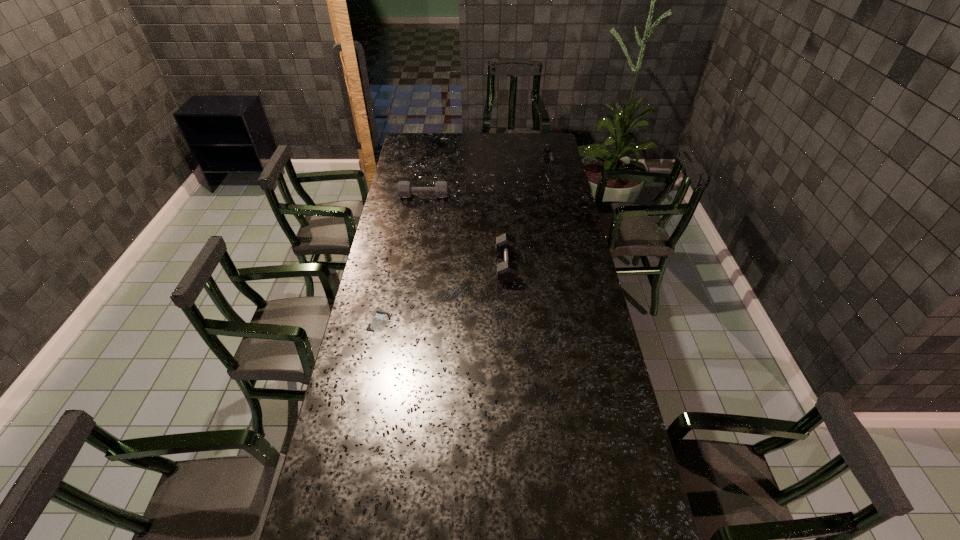
You are a GUI agent. You are given a task and a screenshot of the screen. Output one action in this format:
    pyautogui.click(x=<x>, y=<y>)
    Task: Click on the free space located 0.190m on the back of the second farthest dumbbell
    This screenshot has height=540, width=960.
    Given the screenshot: What is the action you would take?
    [428, 171]

Image resolution: width=960 pixels, height=540 pixels. I want to click on free space located 0.160m on the back of the shortest object, so click(x=388, y=280).

Locate an element on the screen. This screenshot has width=960, height=540. dumbbell present at the left edge is located at coordinates (405, 190).

This screenshot has height=540, width=960. I want to click on identity card located at the left edge, so click(x=380, y=319).

You are a GUI agent. You are given a task and a screenshot of the screen. Output one action in this format:
    pyautogui.click(x=<x>, y=<y>)
    Task: Click on the object that is at the right edge
    The height and width of the screenshot is (540, 960).
    Given the screenshot: What is the action you would take?
    pyautogui.click(x=554, y=170)

Where is `blank space at the far edge of the desktop`? This screenshot has width=960, height=540. blank space at the far edge of the desktop is located at coordinates (454, 153).

At what (x,y) coordinates should I click in order to perform the action: click on free space at the left edge of the desktop. Please return your answer as a coordinate pair (x, y). Looking at the image, I should click on (372, 270).

In the image, there is a desktop. At what (x,y) coordinates should I click in order to perform the action: click on vacant space at the right edge. Please return your answer as a coordinate pair (x, y). The width and height of the screenshot is (960, 540). Looking at the image, I should click on (560, 241).

Identify the location of vacant space at the far left corner of the desktop. This screenshot has height=540, width=960. (425, 138).

The width and height of the screenshot is (960, 540). In order to click on free region at the far right corner of the desktop in this screenshot , I will do `click(528, 136)`.